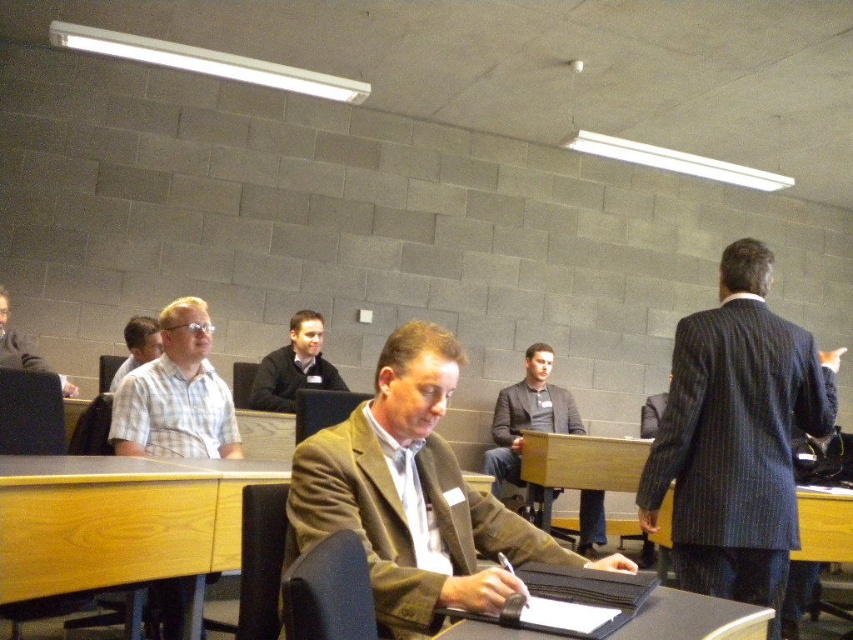
You are standing in the conference room and need to locate the brown woolen suit at center. According to the coordinates provided, where exactly should you look to find it?

The brown woolen suit at center is located at point 0.777 along the x axis and 0.487 along the y axis.

You are organizing a meeting in this room and want to ensure there is enough space for a new chair between the brown woolen suit at center and the wooden desk at center. Based on their sizes, do you think there will be enough space?

The brown woolen suit at center occupies less space than the wooden desk at center, so there should be sufficient space to place a new chair between them.

In the scene described, there is a light brown wood chair at left and a light blue shirt at center. From the perspective of someone facing the front of the room, which object is positioned to the left?

The light brown wood chair at left is positioned to the left of the light blue shirt at center.